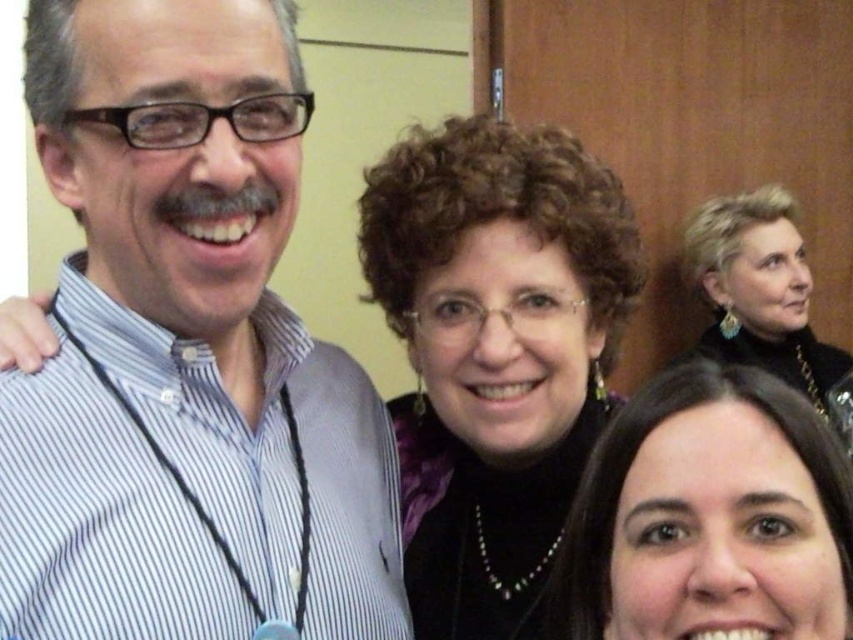
Does dark brown hair at lower right appear on the left side of satin black dress at upper right?

Correct, you'll find dark brown hair at lower right to the left of satin black dress at upper right.

Is dark brown hair at lower right taller than satin black dress at upper right?

No, dark brown hair at lower right is not taller than satin black dress at upper right.

The height and width of the screenshot is (640, 853). I want to click on dark brown hair at lower right, so click(703, 515).

Is point (258, 44) more distant than point (717, 419)?

Yes, it is behind point (717, 419).

Can you confirm if white striped shirt at left is taller than dark brown hair at lower right?

Indeed, white striped shirt at left has a greater height compared to dark brown hair at lower right.

Is point (45, 38) positioned in front of point (677, 586)?

No.

The width and height of the screenshot is (853, 640). I want to click on white striped shirt at left, so click(x=186, y=353).

Does black velvet blouse at center appear on the right side of satin black dress at upper right?

Incorrect, black velvet blouse at center is not on the right side of satin black dress at upper right.

Does black velvet blouse at center have a lesser width compared to satin black dress at upper right?

Indeed, black velvet blouse at center has a lesser width compared to satin black dress at upper right.

What do you see at coordinates (494, 353) in the screenshot? The image size is (853, 640). I see `black velvet blouse at center` at bounding box center [494, 353].

Find the location of a particular element. This screenshot has width=853, height=640. black velvet blouse at center is located at coordinates (494, 353).